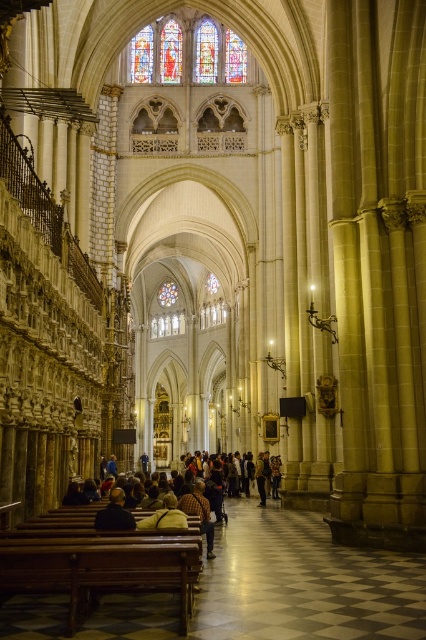
Is brown polished wood bench at lower left smaller than checkered fabric shirt at center?

Actually, brown polished wood bench at lower left might be larger than checkered fabric shirt at center.

Who is more distant from viewer, (72, 534) or (206, 504)?

Point (206, 504)

Does point (178, 561) come farther from viewer compared to point (181, 502)?

No, it is in front of (181, 502).

Find the location of a particular element. brown polished wood bench at lower left is located at coordinates (100, 566).

Which is more to the left, checkered fabric shirt at center or dark brown leather jacket at center?

dark brown leather jacket at center is more to the left.

Based on the photo, which is below, checkered fabric shirt at center or dark brown leather jacket at center?

checkered fabric shirt at center

What do you see at coordinates (199, 513) in the screenshot?
I see `checkered fabric shirt at center` at bounding box center [199, 513].

The height and width of the screenshot is (640, 426). In order to click on checkered fabric shirt at center in this screenshot , I will do `click(199, 513)`.

Measure the distance between brown polished wood bench at lower left and stained glass window at upper center.

A distance of 82.73 meters exists between brown polished wood bench at lower left and stained glass window at upper center.

Who is positioned more to the left, brown polished wood bench at lower left or stained glass window at upper center?

From the viewer's perspective, brown polished wood bench at lower left appears more on the left side.

Is point (26, 580) closer to viewer compared to point (201, 68)?

Yes, it is.

Find the location of a particular element. The height and width of the screenshot is (640, 426). brown polished wood bench at lower left is located at coordinates (100, 566).